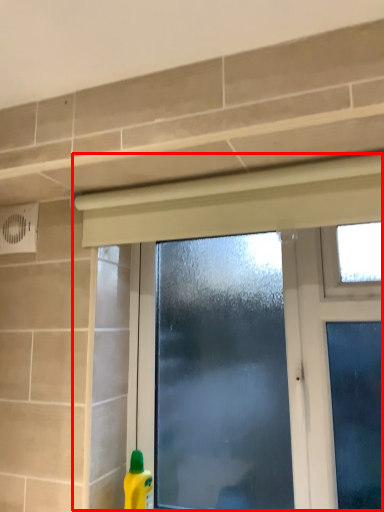
Question: From the image's perspective, where is window (annotated by the red box) located in relation to cleaning product in the image?

Choices:
 (A) below
 (B) above

Answer: (B)